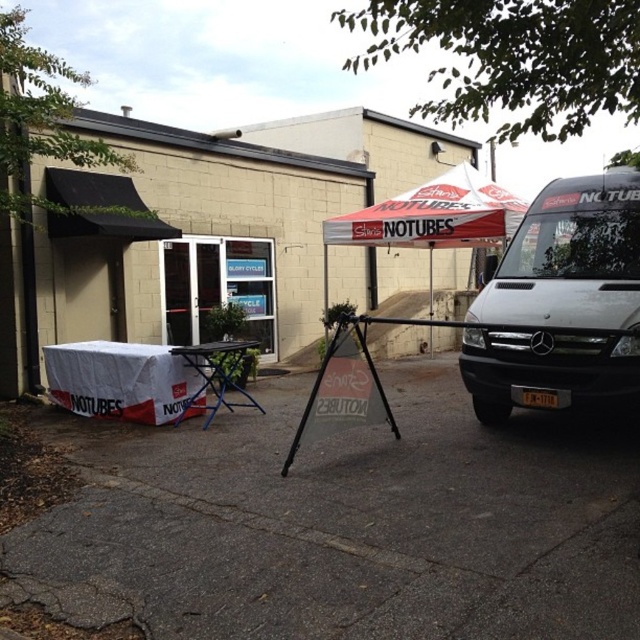
Question: Which point is farther from the camera taking this photo?

Choices:
 (A) (611, 227)
 (B) (492, 221)

Answer: (B)

Question: Which object appears farthest from the camera in this image?

Choices:
 (A) white glossy van at right
 (B) white/red fabric canopy at center

Answer: (B)

Question: In this image, where is white glossy van at right located relative to white/red fabric canopy at center?

Choices:
 (A) right
 (B) left

Answer: (A)

Question: Can you confirm if white glossy van at right is wider than white/red fabric canopy at center?

Choices:
 (A) no
 (B) yes

Answer: (A)

Question: Is white glossy van at right thinner than white/red fabric canopy at center?

Choices:
 (A) no
 (B) yes

Answer: (B)